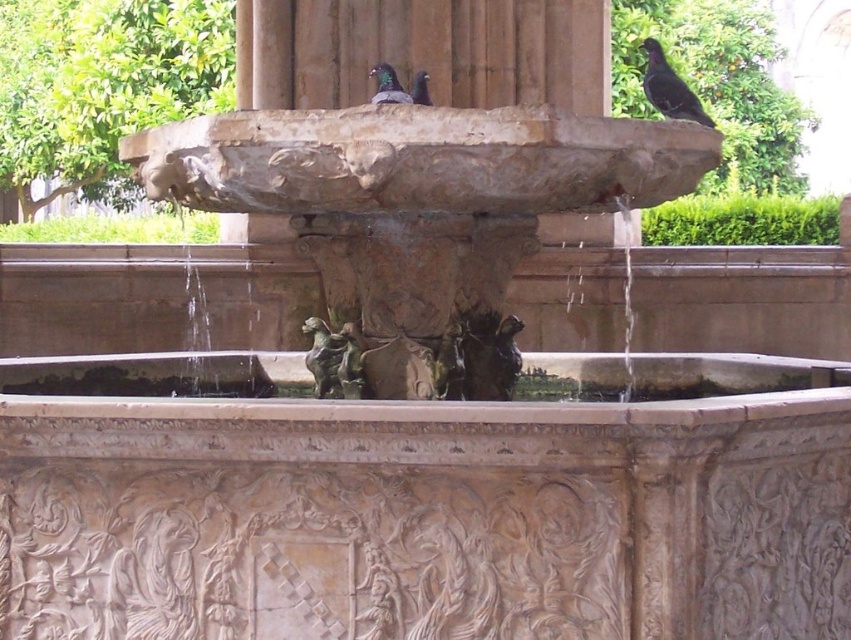
Which is behind, point (680, 88) or point (387, 83)?

Point (680, 88)

Can you confirm if shiny black bird at upper right is wider than shiny dark gray pigeon at upper center?

Indeed, shiny black bird at upper right has a greater width compared to shiny dark gray pigeon at upper center.

Looking at this image, measure the distance between shiny black bird at upper right and camera.

The distance of shiny black bird at upper right from camera is 6.64 meters.

This screenshot has height=640, width=851. I want to click on shiny black bird at upper right, so click(x=669, y=88).

Is point (603, 84) in front of point (384, 92)?

No, it is behind (384, 92).

Which of these two, brown stone pillar at center or shiny dark gray pigeon at upper center, stands taller?

With more height is brown stone pillar at center.

Where is `brown stone pillar at center`? brown stone pillar at center is located at coordinates (426, 51).

Which is above, shiny black bird at upper right or matte black pigeon at upper center?

shiny black bird at upper right is above.

Which is in front, point (678, 108) or point (417, 92)?

Point (417, 92) is more forward.

Identify the location of shiny black bird at upper right. The width and height of the screenshot is (851, 640). (669, 88).